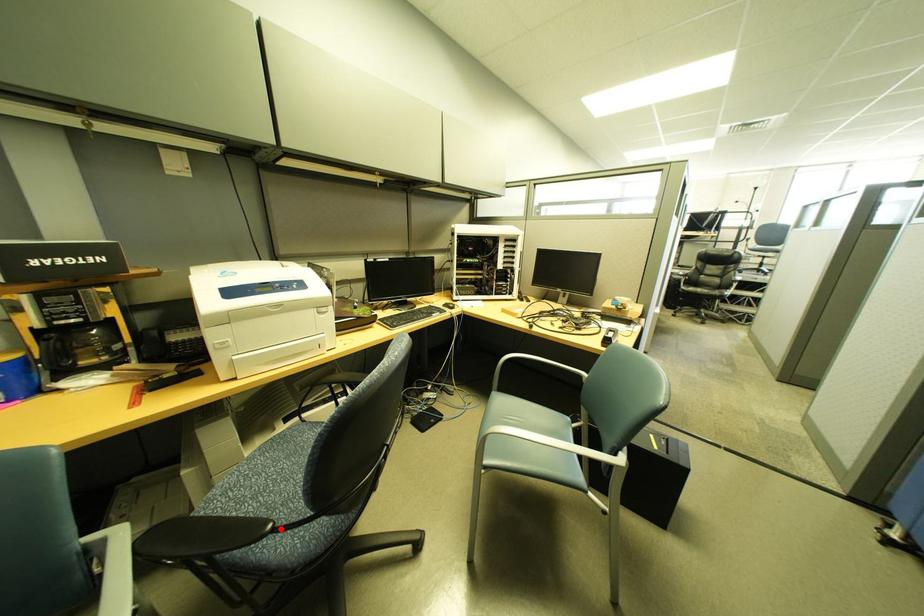
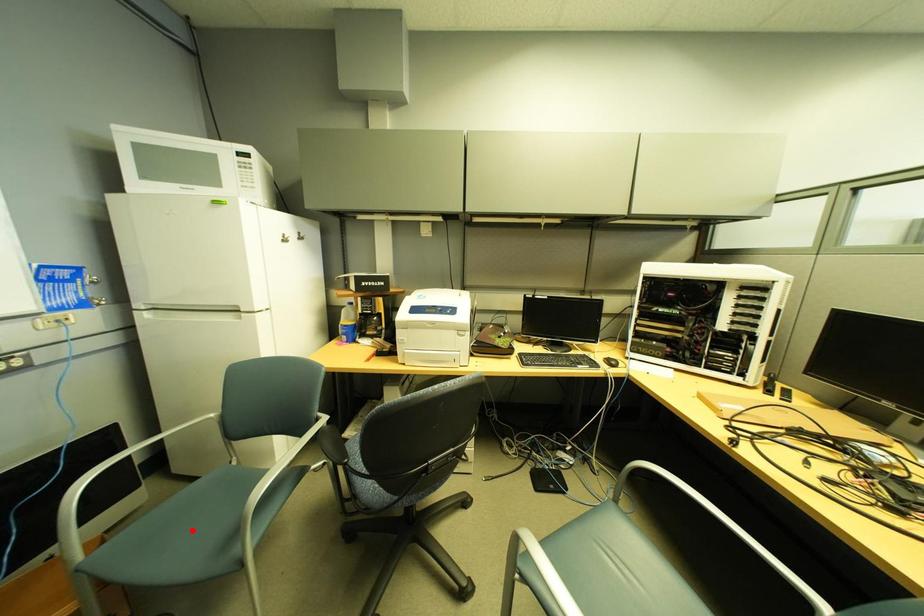
I am providing you with two images of the same scene from different viewpoints. A red point is marked on the first image and another point is marked on the second image. Is the red point in image1 aligned with the point shown in image2?

No